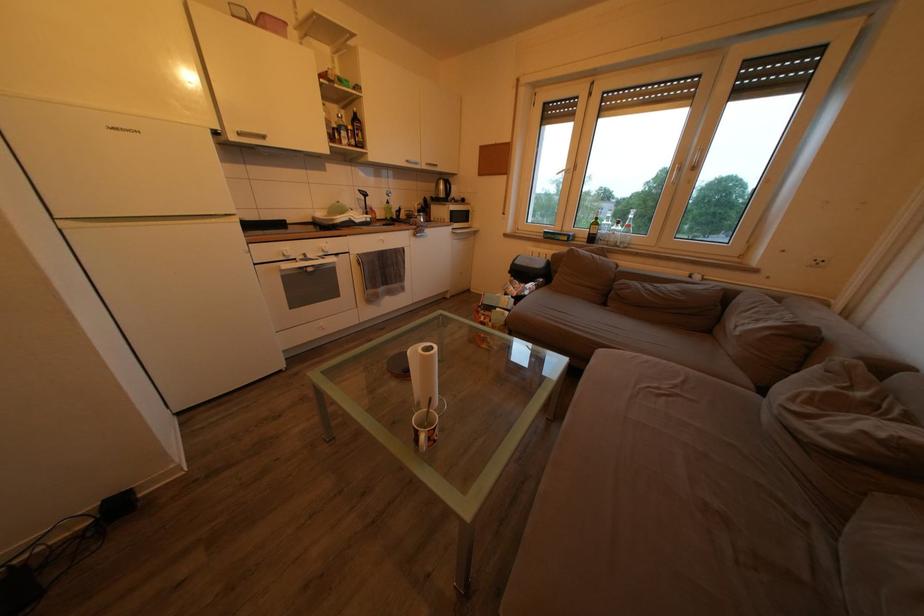
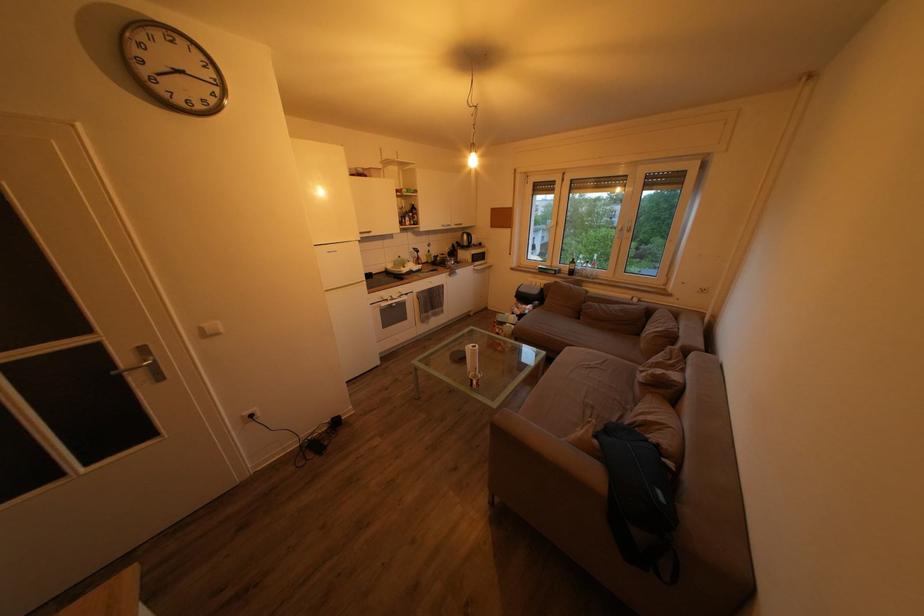
Question: What movement of the cameraman would produce the second image?

Choices:
 (A) Left
 (B) Right
 (C) Forward
 (D) Backward

Answer: (D)